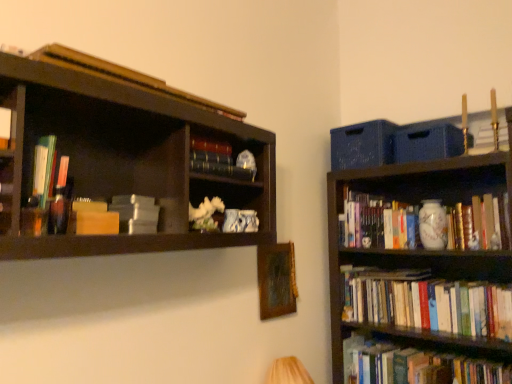
You are a GUI agent. You are given a task and a screenshot of the screen. Output one action in this format:
    pyautogui.click(x=<x>, y=<y>)
    Task: Click on the vacant space situated above white paperbacks at lower right, the second book viewed from the back (from a real-world perspective)
    The width and height of the screenshot is (512, 384).
    Given the screenshot: What is the action you would take?
    [429, 280]